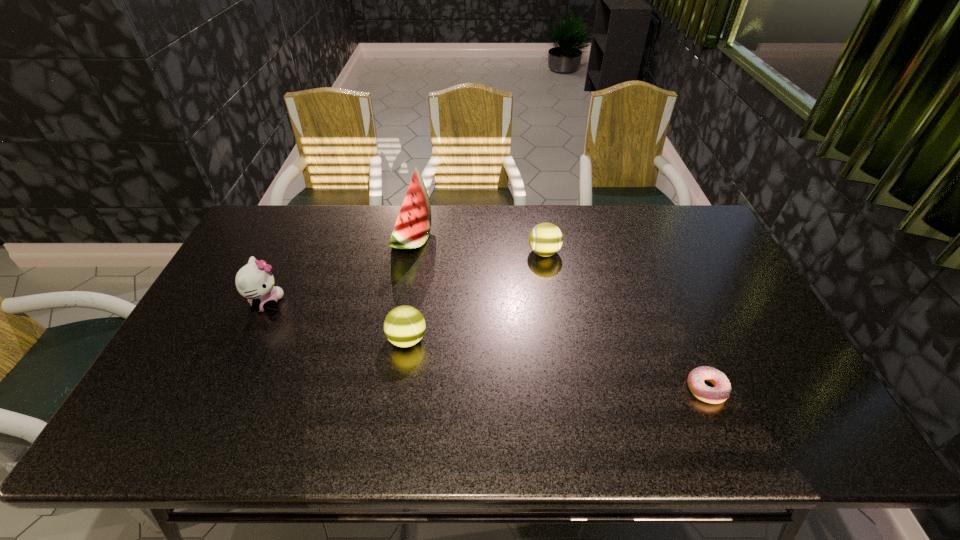
Where is `vacant region that satisfies the following two spatial constraints: 1. on the front-facing side of the leftmost object; 2. on the left side of the rightmost object`? The width and height of the screenshot is (960, 540). vacant region that satisfies the following two spatial constraints: 1. on the front-facing side of the leftmost object; 2. on the left side of the rightmost object is located at coordinates (227, 389).

The image size is (960, 540). What are the coordinates of `free spot that satisfies the following two spatial constraints: 1. on the back side of the left tennis ball; 2. on the front-facing side of the second tallest object` in the screenshot? It's located at (412, 304).

Identify the location of vacant region that satisfies the following two spatial constraints: 1. on the outer rind of the right tennis ball; 2. on the left side of the tallest object. (409, 253).

Locate an element on the screen. The height and width of the screenshot is (540, 960). vacant position in the image that satisfies the following two spatial constraints: 1. on the front-facing side of the nearer tennis ball; 2. on the right side of the fourth shortest object is located at coordinates (250, 339).

Locate an element on the screen. The height and width of the screenshot is (540, 960). vacant space that satisfies the following two spatial constraints: 1. on the outer rind of the tallest object; 2. on the left side of the right tennis ball is located at coordinates (409, 253).

Where is `vacant position in the image that satisfies the following two spatial constraints: 1. on the front side of the farther tennis ball; 2. on the right side of the nearest object`? vacant position in the image that satisfies the following two spatial constraints: 1. on the front side of the farther tennis ball; 2. on the right side of the nearest object is located at coordinates (565, 389).